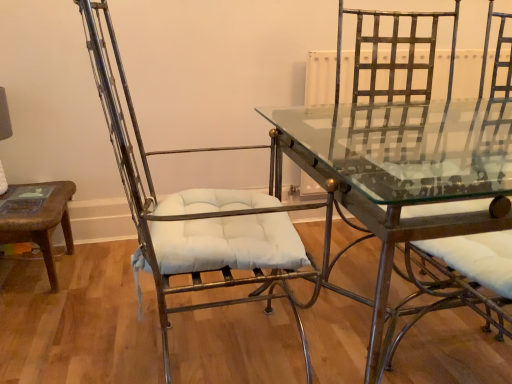
Question: Would you say metallic wire chair at left is a long distance from clear glass table at center?

Choices:
 (A) yes
 (B) no

Answer: (B)

Question: Is metallic wire chair at left smaller than clear glass table at center?

Choices:
 (A) yes
 (B) no

Answer: (A)

Question: Is metallic wire chair at left oriented away from clear glass table at center?

Choices:
 (A) yes
 (B) no

Answer: (B)

Question: Is metallic wire chair at left bigger than clear glass table at center?

Choices:
 (A) yes
 (B) no

Answer: (B)

Question: Is metallic wire chair at left outside clear glass table at center?

Choices:
 (A) yes
 (B) no

Answer: (A)

Question: Is clear glass table at center located within metallic wire chair at left?

Choices:
 (A) no
 (B) yes

Answer: (A)

Question: Is clear glass table at center not near metallic wire chair at left?

Choices:
 (A) yes
 (B) no

Answer: (B)

Question: Does clear glass table at center have a lesser width compared to metallic wire chair at left?

Choices:
 (A) yes
 (B) no

Answer: (B)

Question: Does clear glass table at center have a lesser height compared to metallic wire chair at left?

Choices:
 (A) yes
 (B) no

Answer: (A)

Question: Would you say clear glass table at center is outside metallic wire chair at left?

Choices:
 (A) yes
 (B) no

Answer: (A)

Question: Is clear glass table at center to the right of metallic wire chair at left from the viewer's perspective?

Choices:
 (A) no
 (B) yes

Answer: (B)

Question: Is clear glass table at center to the left of metallic wire chair at left from the viewer's perspective?

Choices:
 (A) no
 (B) yes

Answer: (A)

Question: Is clear glass table at center turned away from metallic gold swivel chair at right?

Choices:
 (A) yes
 (B) no

Answer: (A)